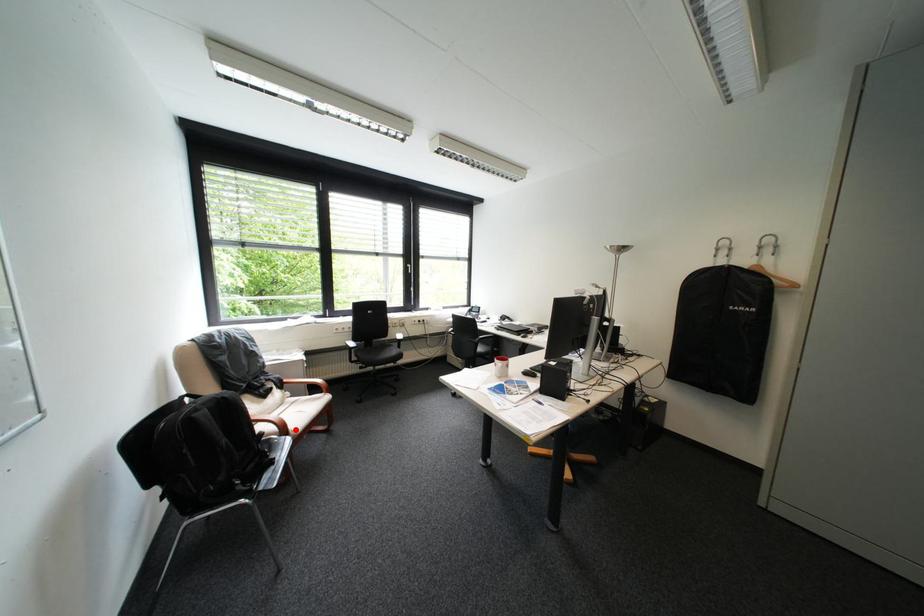
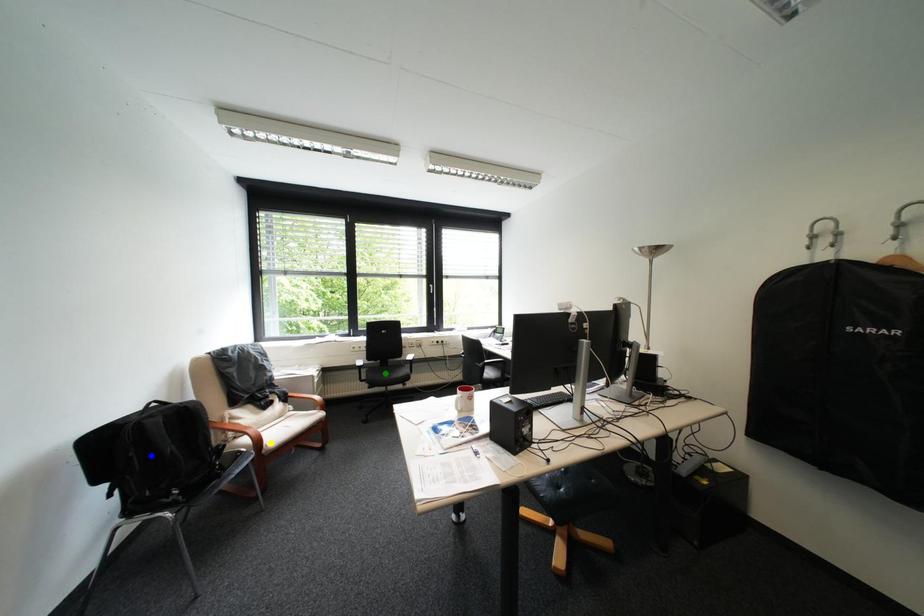
Question: I am providing you with two images of the same scene from different viewpoints. A red point is marked on the first image. You are given multiple points on the second image. Which mark in image 2 goes with the point in image 1?

Choices:
 (A) blue point
 (B) green point
 (C) yellow point

Answer: (C)